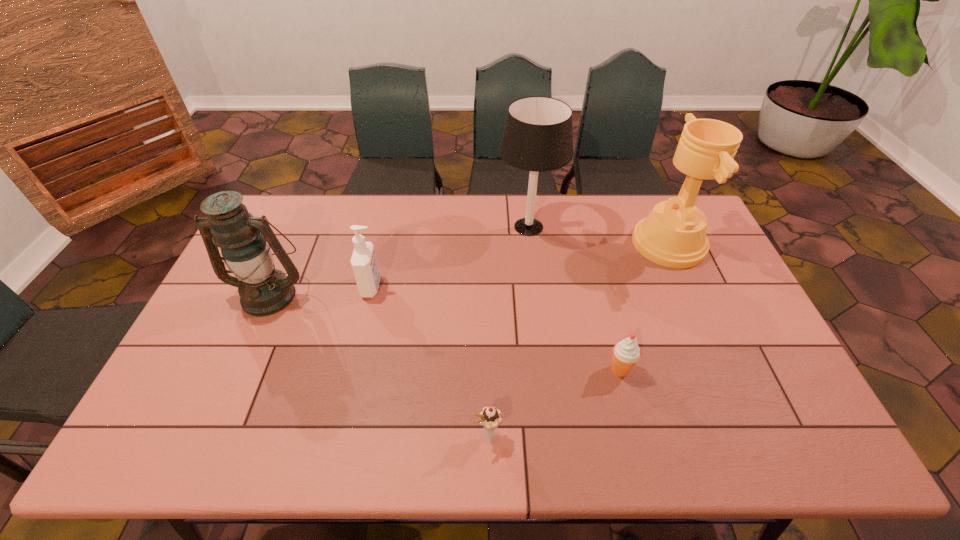
What are the coordinates of `object at the far right corner` in the screenshot? It's located at (673, 235).

Find the location of `vacant space at the far edge`. vacant space at the far edge is located at coordinates (371, 234).

At what (x,y) coordinates should I click in order to perform the action: click on vacant space at the near edge of the desktop. Please return your answer as a coordinate pair (x, y). The width and height of the screenshot is (960, 540). Looking at the image, I should click on (271, 454).

The image size is (960, 540). In the image, there is a desktop. Find the location of `free space at the left edge`. free space at the left edge is located at coordinates pyautogui.click(x=290, y=248).

The image size is (960, 540). Find the location of `free space at the right edge`. free space at the right edge is located at coordinates (680, 270).

In the image, there is a desktop. Identify the location of free space at the far left corner. (300, 210).

I want to click on vacant area that lies between the leftmost object and the award, so click(x=469, y=269).

Identify the location of vacant point located between the award and the second nearest object. click(x=644, y=307).

Where is `vacant area between the award and the fourth object from right to left`? The image size is (960, 540). vacant area between the award and the fourth object from right to left is located at coordinates (578, 339).

At what (x,y) coordinates should I click in order to perform the action: click on free spot between the fifth farthest object and the rightmost object. Please return your answer as a coordinate pair (x, y). The image size is (960, 540). Looking at the image, I should click on (644, 307).